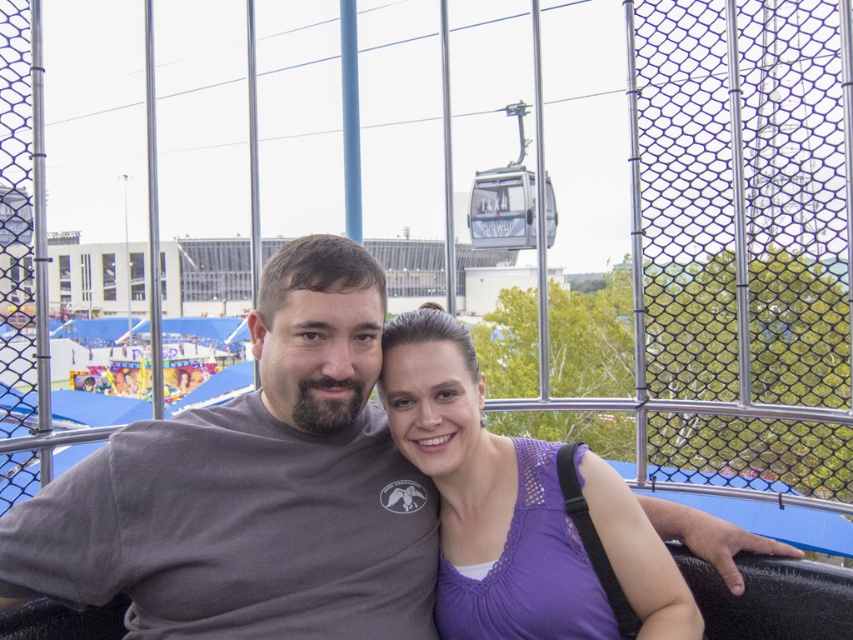
Who is shorter, gray matte shirt at center or metal cable car at upper center?

Standing shorter between the two is gray matte shirt at center.

Is point (306, 433) closer to viewer compared to point (524, 148)?

Yes, point (306, 433) is in front of point (524, 148).

Find the location of a particular element. gray matte shirt at center is located at coordinates (252, 488).

Who is positioned more to the right, purple lace top at center or metal cable car at upper center?

metal cable car at upper center is more to the right.

At what (x,y) coordinates should I click in order to perform the action: click on purple lace top at center. Please return your answer as a coordinate pair (x, y). Looking at the image, I should click on (485, 497).

Between gray matte shirt at center and purple lace top at center, which one has more height?

gray matte shirt at center is taller.

Is gray matte shirt at center thinner than purple lace top at center?

No.

Is point (96, 595) farther from viewer compared to point (444, 330)?

No, it is in front of (444, 330).

Identify the location of gray matte shirt at center. This screenshot has height=640, width=853. (252, 488).